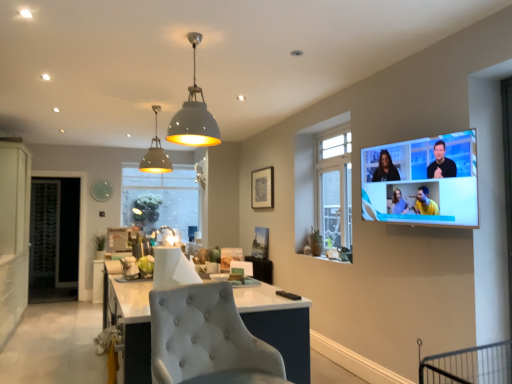
Question: Should I look upward or downward to see matte gray pendant light at upper center?

Choices:
 (A) down
 (B) up

Answer: (B)

Question: From the image's perspective, is white matte cabinet at left beneath flat screen tv at upper right?

Choices:
 (A) yes
 (B) no

Answer: (A)

Question: Is white matte cabinet at left facing towards flat screen tv at upper right?

Choices:
 (A) no
 (B) yes

Answer: (A)

Question: Considering the relative sizes of white matte cabinet at left and flat screen tv at upper right in the image provided, is white matte cabinet at left wider than flat screen tv at upper right?

Choices:
 (A) yes
 (B) no

Answer: (A)

Question: Does white matte cabinet at left have a lesser height compared to flat screen tv at upper right?

Choices:
 (A) no
 (B) yes

Answer: (A)

Question: From a real-world perspective, is white matte cabinet at left on flat screen tv at upper right?

Choices:
 (A) yes
 (B) no

Answer: (B)

Question: Is flat screen tv at upper right at the back of white matte cabinet at left?

Choices:
 (A) no
 (B) yes

Answer: (A)

Question: Is clear glass window at center, which is the 1th window in left-to-right order, to the left of matte white dome at upper center from the viewer's perspective?

Choices:
 (A) yes
 (B) no

Answer: (A)

Question: From the image's perspective, is clear glass window at center, the second window from the right, on matte white dome at upper center?

Choices:
 (A) yes
 (B) no

Answer: (B)

Question: Is clear glass window at center, which is the 1th window in left-to-right order, not close to matte white dome at upper center?

Choices:
 (A) no
 (B) yes

Answer: (B)

Question: Is clear glass window at center, which is the 1th window in left-to-right order, taller than matte white dome at upper center?

Choices:
 (A) yes
 (B) no

Answer: (A)

Question: Can you confirm if clear glass window at center, which is the 2th window from front to back, is wider than matte white dome at upper center?

Choices:
 (A) yes
 (B) no

Answer: (B)

Question: Is clear glass window at center, which is the 1th window in left-to-right order, turned away from matte white dome at upper center?

Choices:
 (A) no
 (B) yes

Answer: (A)

Question: Does clear glass door at left appear on the left side of clear glass window at center, which ranks as the first window in back-to-front order?

Choices:
 (A) yes
 (B) no

Answer: (A)